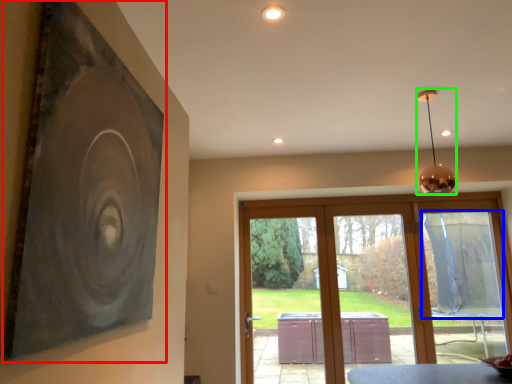
Question: Which object is the farthest from picture frame (highlighted by a red box)? Choose among these: window screen (highlighted by a blue box) or lamp (highlighted by a green box).

Choices:
 (A) window screen
 (B) lamp

Answer: (A)